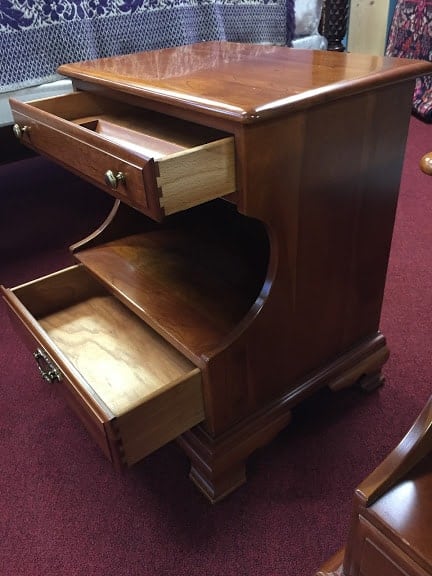
Find the location of a particular element. This screenshot has width=432, height=576. nightstand is located at coordinates [x=251, y=65].